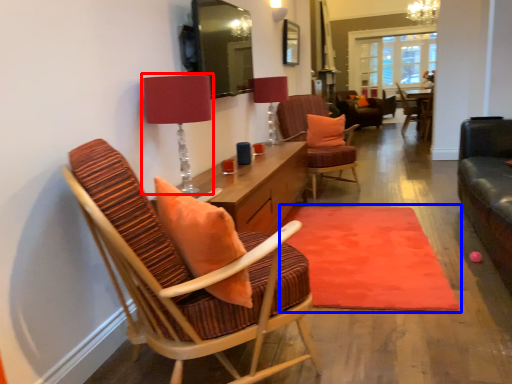
Question: Which object appears closest to the camera in this image, table lamp (highlighted by a red box) or mat (highlighted by a blue box)?

Choices:
 (A) table lamp
 (B) mat

Answer: (A)